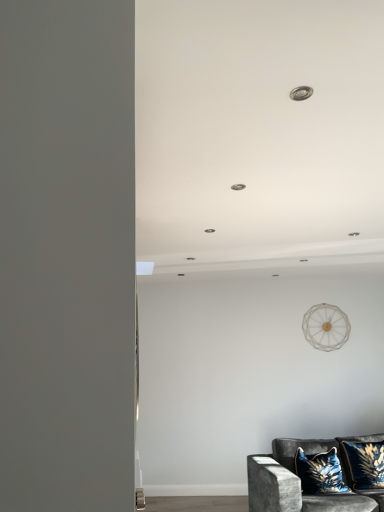
Describe the element at coordinates (299, 480) in the screenshot. I see `velvet dark gray couch at lower right` at that location.

What do you see at coordinates (363, 464) in the screenshot? The height and width of the screenshot is (512, 384). I see `velvet blue pillow at lower right, placed as the first pillow when sorted from right to left` at bounding box center [363, 464].

Where is `velvet blue pillow at lower right, the 2th pillow positioned from the right`? Image resolution: width=384 pixels, height=512 pixels. velvet blue pillow at lower right, the 2th pillow positioned from the right is located at coordinates (320, 472).

Image resolution: width=384 pixels, height=512 pixels. Find the location of `pillow on the right side of velvet dark gray couch at lower right`. pillow on the right side of velvet dark gray couch at lower right is located at coordinates (363, 464).

From the image's perspective, which one is positioned lower, velvet blue pillow at lower right, placed as the first pillow when sorted from right to left, or velvet dark gray couch at lower right?

velvet dark gray couch at lower right, from the image's perspective.

Consider the image. Does velvet blue pillow at lower right, placed as the first pillow when sorted from right to left, have a larger size compared to velvet dark gray couch at lower right?

A: Actually, velvet blue pillow at lower right, placed as the first pillow when sorted from right to left, might be smaller than velvet dark gray couch at lower right.

Considering the sizes of objects velvet blue pillow at lower right, which appears as the 2th pillow when viewed from the left, and velvet dark gray couch at lower right in the image provided, who is thinner, velvet blue pillow at lower right, which appears as the 2th pillow when viewed from the left, or velvet dark gray couch at lower right?

velvet blue pillow at lower right, which appears as the 2th pillow when viewed from the left.

Considering the relative sizes of velvet blue pillow at lower right, which appears as the 2th pillow when viewed from the left, and velvet blue pillow at lower right, the 2th pillow positioned from the right, in the image provided, is velvet blue pillow at lower right, which appears as the 2th pillow when viewed from the left, wider than velvet blue pillow at lower right, the 2th pillow positioned from the right,?

In fact, velvet blue pillow at lower right, which appears as the 2th pillow when viewed from the left, might be narrower than velvet blue pillow at lower right, the 2th pillow positioned from the right.

Considering the positions of objects velvet blue pillow at lower right, placed as the first pillow when sorted from right to left, and velvet blue pillow at lower right, the 2th pillow positioned from the right, in the image provided, who is more to the right, velvet blue pillow at lower right, placed as the first pillow when sorted from right to left, or velvet blue pillow at lower right, the 2th pillow positioned from the right,?

From the viewer's perspective, velvet blue pillow at lower right, placed as the first pillow when sorted from right to left, appears more on the right side.

Which object is closer to the camera taking this photo, velvet blue pillow at lower right, which appears as the 2th pillow when viewed from the left, or velvet blue pillow at lower right, marked as the first pillow in a left-to-right arrangement?

velvet blue pillow at lower right, marked as the first pillow in a left-to-right arrangement, is more forward.

From the picture: Which is farther, (309, 475) or (347, 458)?

The point (347, 458) is behind.

Is velvet blue pillow at lower right, the 2th pillow positioned from the right, not within velvet blue pillow at lower right, placed as the first pillow when sorted from right to left?

Yes, velvet blue pillow at lower right, the 2th pillow positioned from the right, is located beyond the bounds of velvet blue pillow at lower right, placed as the first pillow when sorted from right to left.

Does velvet blue pillow at lower right, the 2th pillow positioned from the right, have a larger size compared to velvet blue pillow at lower right, which appears as the 2th pillow when viewed from the left?

Correct, velvet blue pillow at lower right, the 2th pillow positioned from the right, is larger in size than velvet blue pillow at lower right, which appears as the 2th pillow when viewed from the left.

Consider the image. Between velvet blue pillow at lower right, the 2th pillow positioned from the right, and velvet blue pillow at lower right, placed as the first pillow when sorted from right to left, which one is positioned behind?

velvet blue pillow at lower right, placed as the first pillow when sorted from right to left.

What's the angular difference between velvet dark gray couch at lower right and velvet blue pillow at lower right, the 2th pillow positioned from the right,'s facing directions?

7.97 degrees.

Between velvet dark gray couch at lower right and velvet blue pillow at lower right, the 2th pillow positioned from the right, which one has larger size?

velvet dark gray couch at lower right.

Which object is thinner, velvet dark gray couch at lower right or velvet blue pillow at lower right, marked as the first pillow in a left-to-right arrangement?

velvet blue pillow at lower right, marked as the first pillow in a left-to-right arrangement.

From a real-world perspective, is velvet dark gray couch at lower right located beneath velvet blue pillow at lower right, the 2th pillow positioned from the right?

Yes.

Is velvet dark gray couch at lower right looking in the opposite direction of velvet blue pillow at lower right, placed as the first pillow when sorted from right to left?

That's right, velvet dark gray couch at lower right is facing away from velvet blue pillow at lower right, placed as the first pillow when sorted from right to left.

Is velvet dark gray couch at lower right in contact with velvet blue pillow at lower right, placed as the first pillow when sorted from right to left?

velvet dark gray couch at lower right and velvet blue pillow at lower right, placed as the first pillow when sorted from right to left, are not in contact.

Between velvet dark gray couch at lower right and velvet blue pillow at lower right, which appears as the 2th pillow when viewed from the left, which one appears on the right side from the viewer's perspective?

velvet blue pillow at lower right, which appears as the 2th pillow when viewed from the left, is more to the right.

Does velvet dark gray couch at lower right have a lesser height compared to velvet blue pillow at lower right, placed as the first pillow when sorted from right to left?

No.

Is velvet blue pillow at lower right, the 2th pillow positioned from the right, in contact with velvet dark gray couch at lower right?

No, velvet blue pillow at lower right, the 2th pillow positioned from the right, is not touching velvet dark gray couch at lower right.

Which is in front, point (320, 481) or point (288, 485)?

The point (288, 485) is closer.

In the scene shown: Between velvet blue pillow at lower right, the 2th pillow positioned from the right, and velvet dark gray couch at lower right, which one has larger width?

velvet dark gray couch at lower right is wider.

Choose the correct answer: Is velvet blue pillow at lower right, marked as the first pillow in a left-to-right arrangement, inside velvet dark gray couch at lower right or outside it?

velvet blue pillow at lower right, marked as the first pillow in a left-to-right arrangement, fits inside velvet dark gray couch at lower right.

Identify the location of pillow on the right side of velvet dark gray couch at lower right. Image resolution: width=384 pixels, height=512 pixels. (363, 464).

This screenshot has width=384, height=512. I want to click on pillow above the velvet blue pillow at lower right, the 2th pillow positioned from the right (from a real-world perspective), so click(x=363, y=464).

Looking at the image, which one is located further to velvet blue pillow at lower right, placed as the first pillow when sorted from right to left, velvet blue pillow at lower right, marked as the first pillow in a left-to-right arrangement, or velvet dark gray couch at lower right?

Based on the image, velvet dark gray couch at lower right appears to be further to velvet blue pillow at lower right, placed as the first pillow when sorted from right to left.

From the image, which object appears to be farther from velvet dark gray couch at lower right, velvet blue pillow at lower right, which appears as the 2th pillow when viewed from the left, or velvet blue pillow at lower right, the 2th pillow positioned from the right?

velvet blue pillow at lower right, which appears as the 2th pillow when viewed from the left, is positioned further to the anchor velvet dark gray couch at lower right.

From the image, which object appears to be nearer to velvet blue pillow at lower right, marked as the first pillow in a left-to-right arrangement, velvet blue pillow at lower right, placed as the first pillow when sorted from right to left, or velvet dark gray couch at lower right?

Among the two, velvet dark gray couch at lower right is located nearer to velvet blue pillow at lower right, marked as the first pillow in a left-to-right arrangement.

Which object lies nearer to the anchor point velvet blue pillow at lower right, placed as the first pillow when sorted from right to left, velvet dark gray couch at lower right or velvet blue pillow at lower right, marked as the first pillow in a left-to-right arrangement?

velvet blue pillow at lower right, marked as the first pillow in a left-to-right arrangement, is closer to velvet blue pillow at lower right, placed as the first pillow when sorted from right to left.

From the image, which object appears to be farther from velvet blue pillow at lower right, the 2th pillow positioned from the right, velvet dark gray couch at lower right or velvet blue pillow at lower right, which appears as the 2th pillow when viewed from the left?

Among the two, velvet blue pillow at lower right, which appears as the 2th pillow when viewed from the left, is located further to velvet blue pillow at lower right, the 2th pillow positioned from the right.

Which object lies further to the anchor point velvet dark gray couch at lower right, velvet blue pillow at lower right, the 2th pillow positioned from the right, or velvet blue pillow at lower right, placed as the first pillow when sorted from right to left?

Among the two, velvet blue pillow at lower right, placed as the first pillow when sorted from right to left, is located further to velvet dark gray couch at lower right.

Find the location of a particular element. The height and width of the screenshot is (512, 384). pillow between velvet dark gray couch at lower right and velvet blue pillow at lower right, placed as the first pillow when sorted from right to left, in the front-back direction is located at coordinates (320, 472).